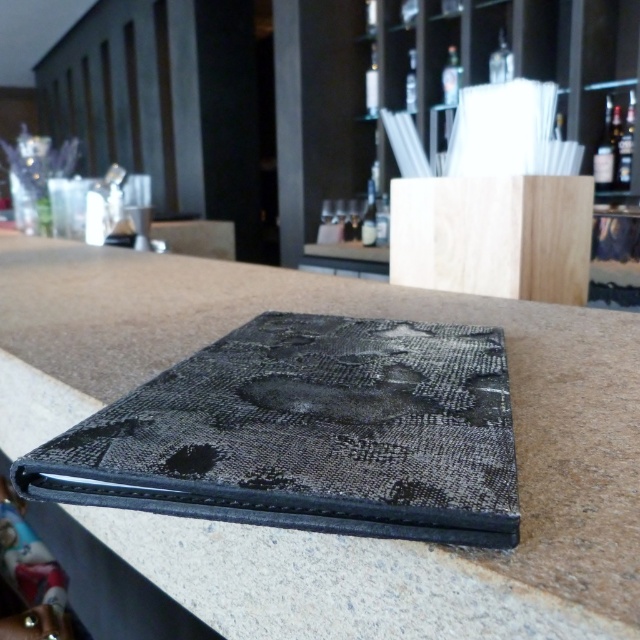
Looking at this image, between translucent glass bottle at upper right and translucent glass bottle at upper center, which one is positioned higher?

translucent glass bottle at upper center is above.

In the scene shown: Is translucent glass bottle at upper right taller than translucent glass bottle at upper center?

Yes, translucent glass bottle at upper right is taller than translucent glass bottle at upper center.

Where is `translucent glass bottle at upper right`? This screenshot has width=640, height=640. translucent glass bottle at upper right is located at coordinates (604, 150).

Does matte black bottle at upper right appear over transparent glass bottle at upper center?

Actually, matte black bottle at upper right is below transparent glass bottle at upper center.

Is matte black bottle at upper right to the left of transparent glass bottle at upper center from the viewer's perspective?

Incorrect, matte black bottle at upper right is not on the left side of transparent glass bottle at upper center.

This screenshot has height=640, width=640. Identify the location of matte black bottle at upper right. (625, 145).

Between point (497, 60) and point (371, 216), which one is positioned in front?

Positioned in front is point (497, 60).

Find the location of a particular element. The image size is (640, 640). clear glass bottle at upper right is located at coordinates (500, 61).

Is point (499, 74) closer to camera compared to point (372, 227)?

No.

At what (x,y) coordinates should I click in order to perform the action: click on clear glass bottle at upper right. Please return your answer as a coordinate pair (x, y). The width and height of the screenshot is (640, 640). Looking at the image, I should click on (500, 61).